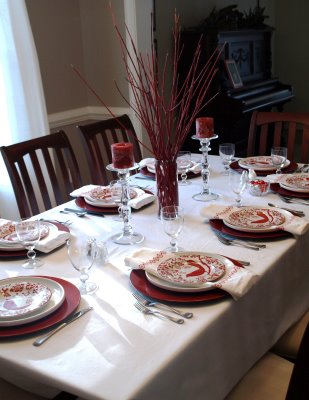
The width and height of the screenshot is (309, 400). Find the location of `plates`. plates is located at coordinates (29, 238), (30, 290), (199, 268), (243, 218), (297, 172), (257, 159), (187, 162), (101, 193).